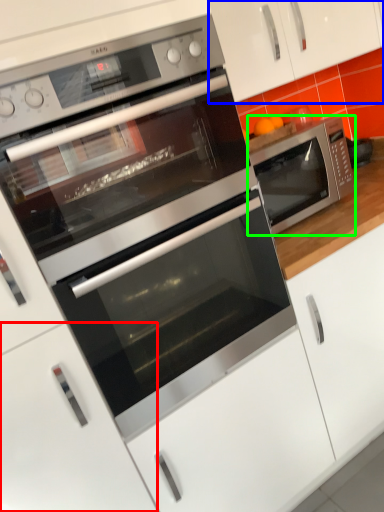
Question: Which object is positioned closest to drawer (highlighted by a red box)? Select from cabinetry (highlighted by a blue box) and microwave oven (highlighted by a green box).

Choices:
 (A) cabinetry
 (B) microwave oven

Answer: (B)